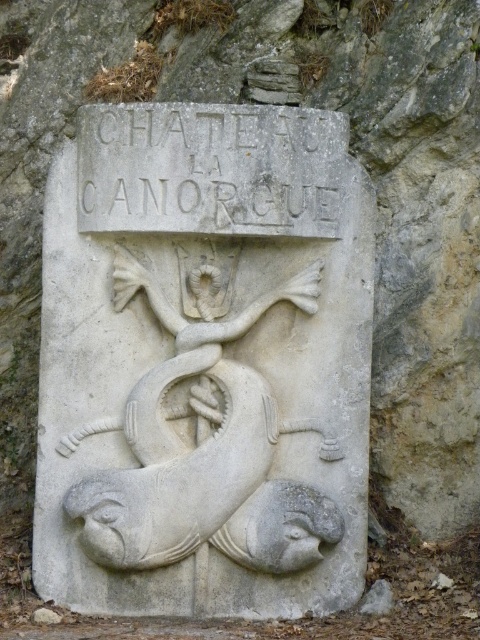
You are standing in front of the stone plaque at CHATEAU LA CANORQUE. You see two points marked on the plaque. The first point is at coordinates point [331,534] and the second is at point [307,212]. Which point is closer to you?

Point [331,534] is in front of point [307,212], so the first point is closer to you.

You are an architect examining the stone plaque. You notice the white stone fish at center and the white stone text at center. Which object is closer to you?

The white stone fish at center is closer to you because it is in front of the white stone text at center.